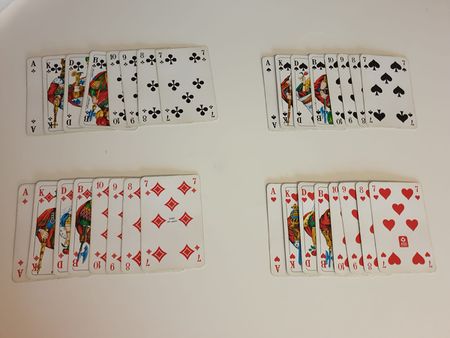
You are a GUI agent. You are given a task and a screenshot of the screen. Output one action in this format:
    pyautogui.click(x=<x>, y=<y>)
    Task: Click on the table
    Image resolution: width=450 pixels, height=338 pixels.
    Given the screenshot: What is the action you would take?
    pyautogui.click(x=242, y=315)